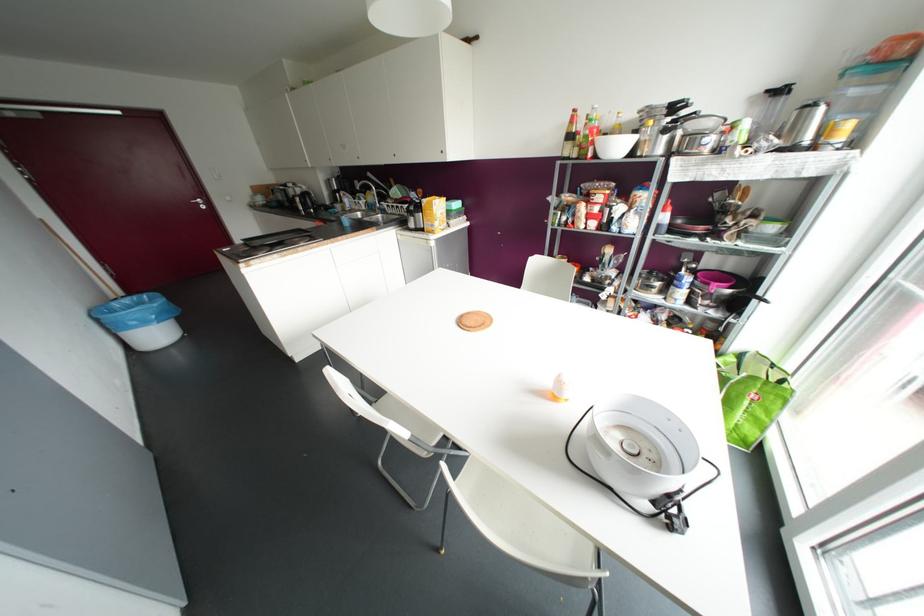
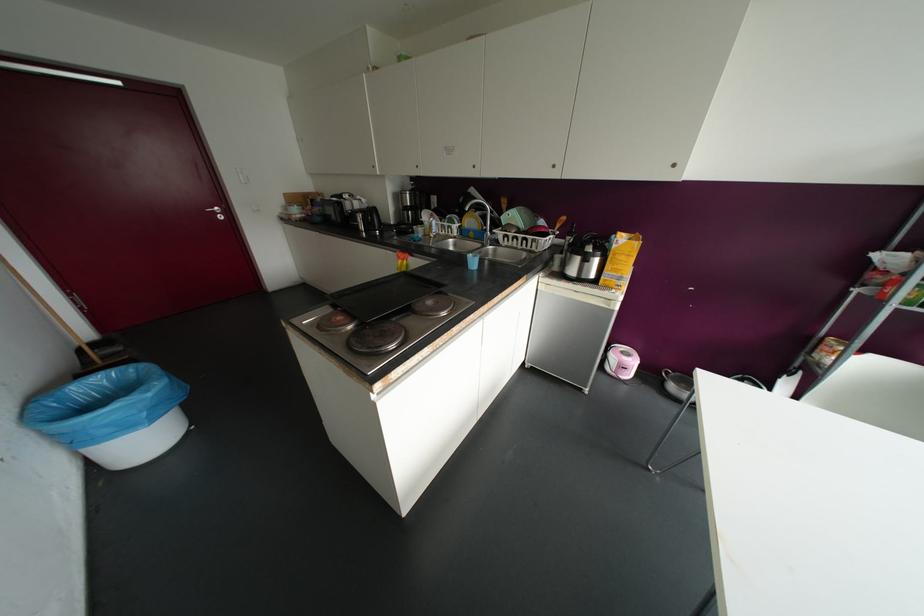
From the picture: What movement of the cameraman would produce the second image?

The movement direction of the cameraman is left, forward.